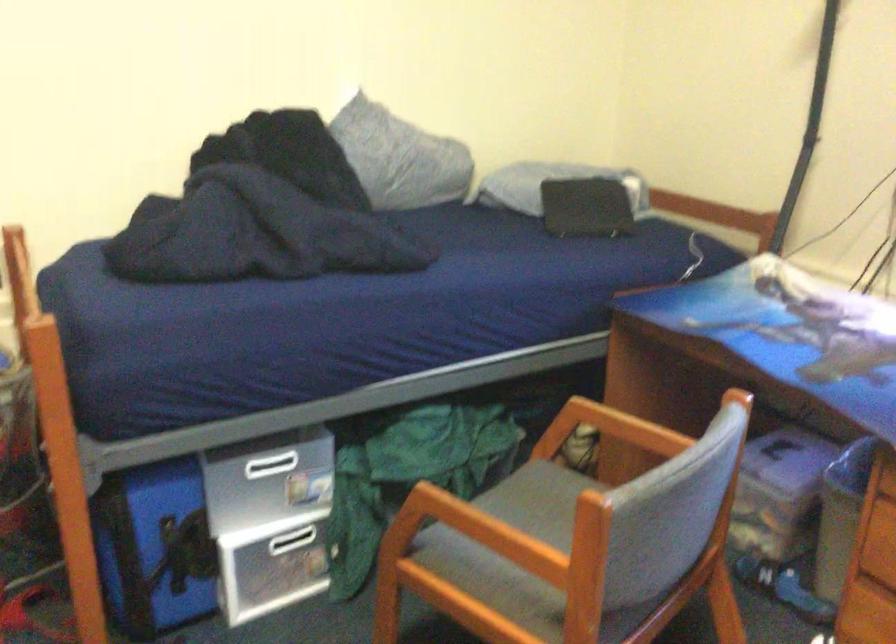
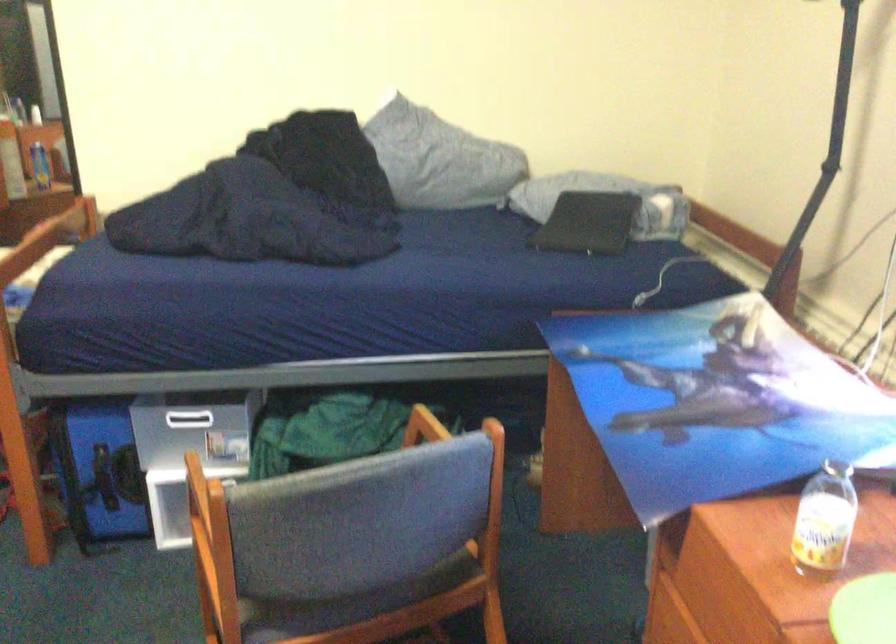
Question: The images are taken continuously from a first-person perspective. In which direction are you moving?

Choices:
 (A) Left
 (B) Right
 (C) Forward
 (D) Backward

Answer: (B)